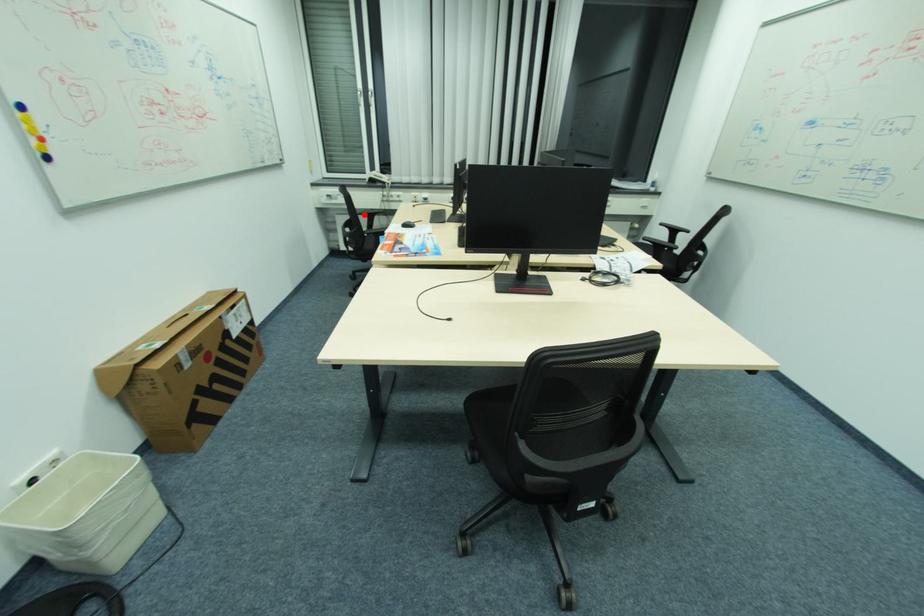
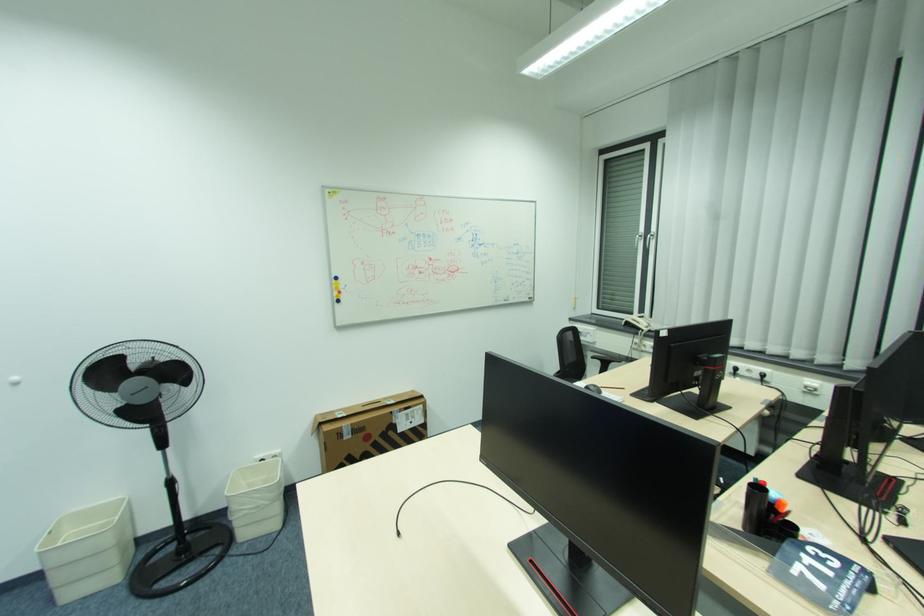
Find the pixel in the second image that matches the highlighted location in the first image.

(599, 358)